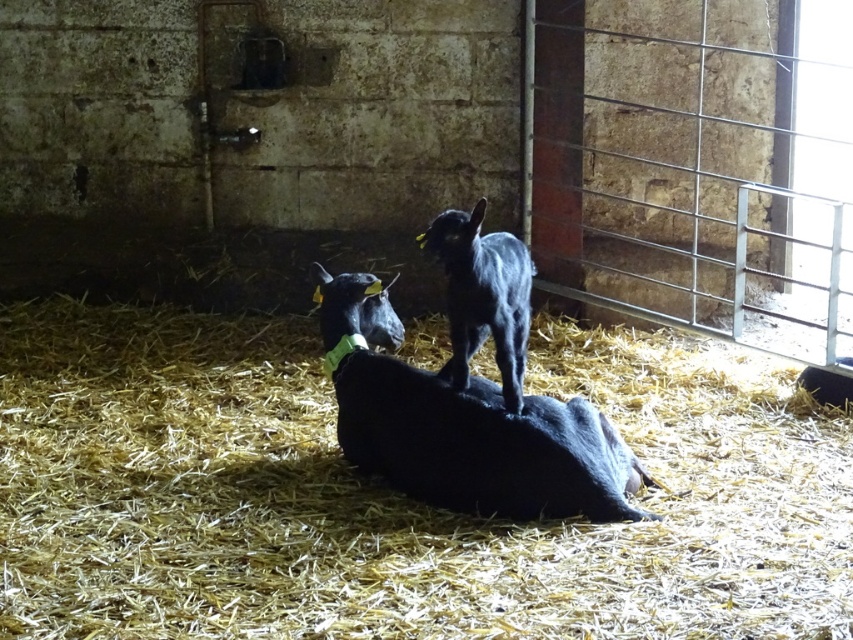
Question: Is black matte goat at center bigger than black furry goat at center?

Choices:
 (A) yes
 (B) no

Answer: (A)

Question: Does black matte goat at center appear on the left side of black furry goat at center?

Choices:
 (A) yes
 (B) no

Answer: (A)

Question: Estimate the real-world distances between objects in this image. Which object is farther from the black matte goat at center?

Choices:
 (A) black furry goat at center
 (B) yellow straw at center

Answer: (B)

Question: Which point is closer to the camera?

Choices:
 (A) black matte goat at center
 (B) yellow straw at center
 (C) black furry goat at center

Answer: (B)

Question: Is black matte goat at center positioned before black furry goat at center?

Choices:
 (A) no
 (B) yes

Answer: (A)

Question: Which object appears closest to the camera in this image?

Choices:
 (A) yellow straw at center
 (B) black furry goat at center

Answer: (A)